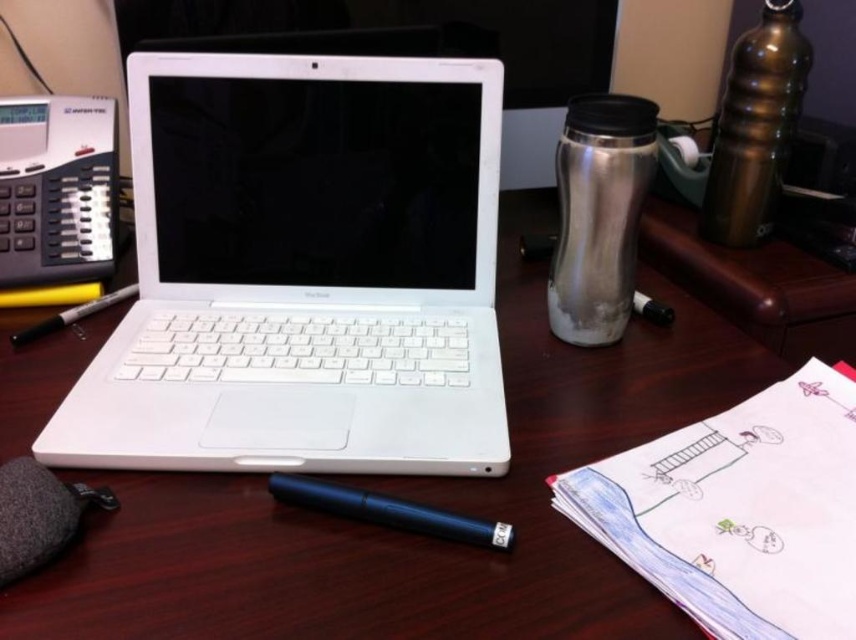
You are organizing your desk and need to place a 10 inch ruler between the white plastic laptop at center and the yellow matte marker at left. Is there enough space to fit the ruler horizontally between them?

The distance between the white plastic laptop at center and the yellow matte marker at left is 9.43 inches, which is less than the 10 inch ruler. Therefore, there is not enough space to fit the ruler horizontally between them.

You are organizing the desk items and need to place the white plastic laptop at center and the yellow matte marker at left into a drawer. The drawer has a width limit of 12 inches. Which item might not fit if placed sideways?

The white plastic laptop at center has a greater width than the yellow matte marker at left, so the white plastic laptop at center might not fit in the drawer if placed sideways.